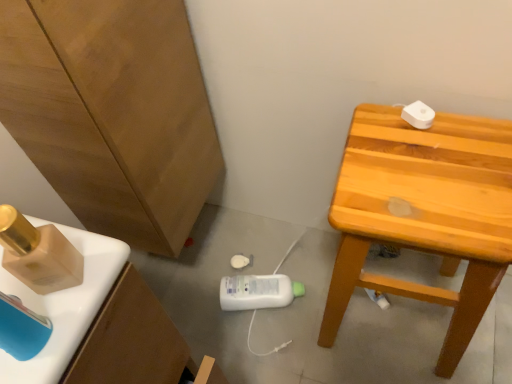
Where is `vacant area on top of light brown wooden stool at upper right (from a real-world perspective)`? The image size is (512, 384). vacant area on top of light brown wooden stool at upper right (from a real-world perspective) is located at coordinates (437, 176).